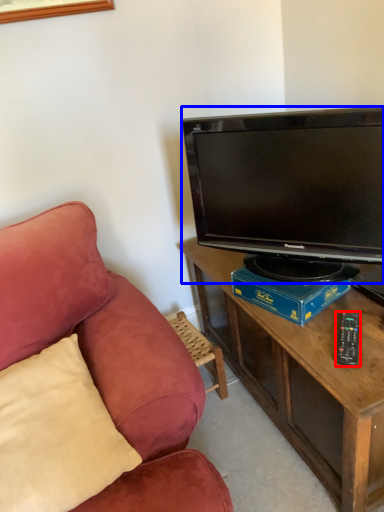
Question: Which object is closer to the camera taking this photo, remote control (highlighted by a red box) or television (highlighted by a blue box)?

Choices:
 (A) remote control
 (B) television

Answer: (B)